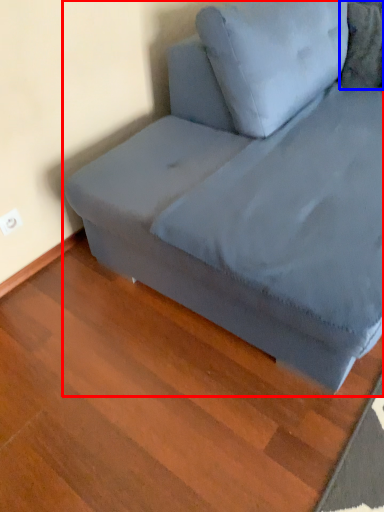
Question: Among these objects, which one is nearest to the camera, studio couch (highlighted by a red box) or pillow (highlighted by a blue box)?

Choices:
 (A) studio couch
 (B) pillow

Answer: (A)